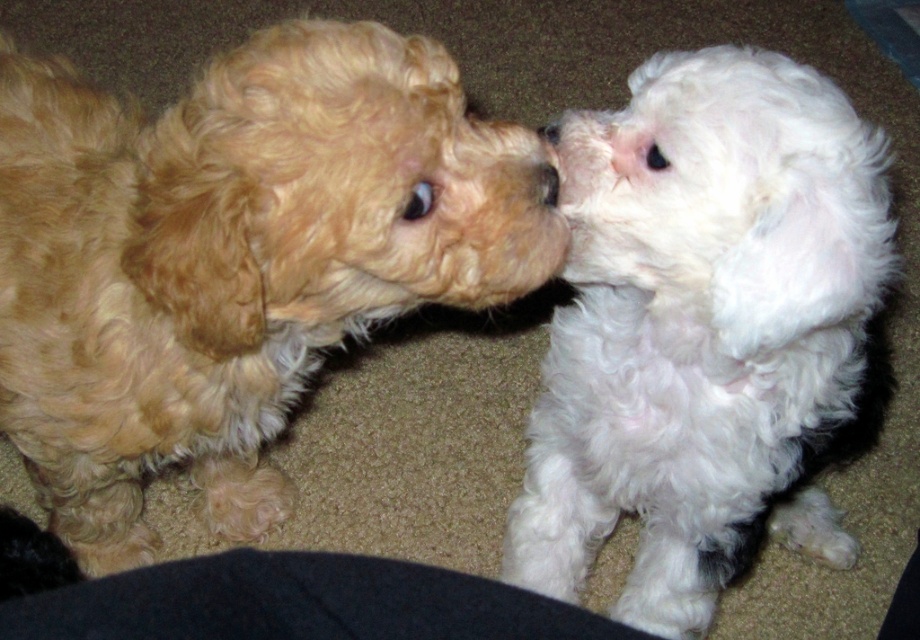
In the scene shown: You are a photographer setting up a camera to capture the two puppies in the scene. You want to ensure that both points, point (99, 243) and point (849, 184), are visible in the frame. Based on their positions, which point is closer to the camera?

Point (849, 184) is closer to the camera because point (99, 243) is behind it.